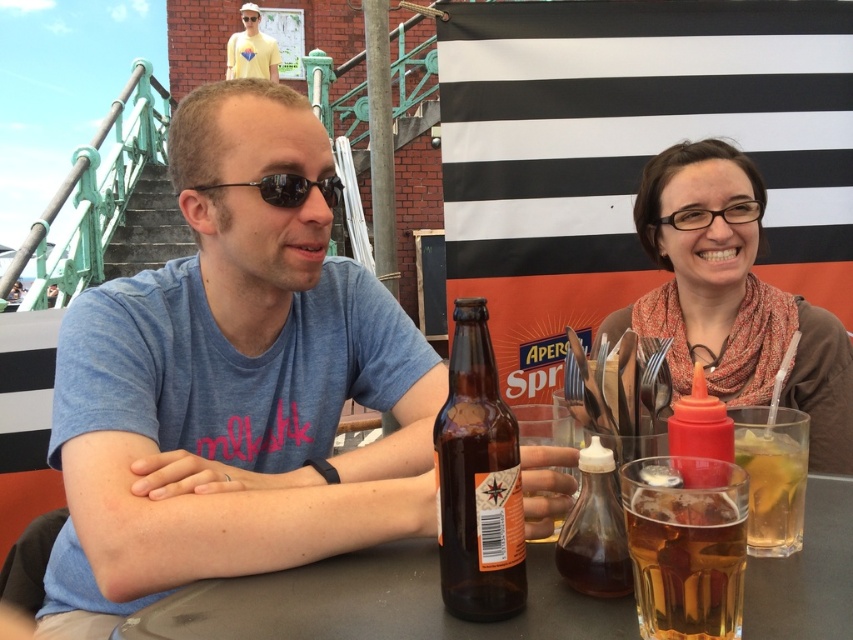
You are a photographer trying to capture the scene from the left side of the table. Which object, the translucent glass bottle at center or the sunglasses at center, would appear closer to the edge of the table in your photo?

The sunglasses at center would appear closer to the edge of the table in the photo because the translucent glass bottle at center is positioned to the right of the sunglasses at center, meaning the sunglasses are nearer to the left edge from the photographer perspective.

Where is the smooth gray table at center located in the image?

The smooth gray table at center is located at point 0.944 on the x axis and 0.438 on the y axis.

Consider the image. You are a server at the outdoor dining area. You need to place a new menu on the table without blocking the brown glass bottle at center. Considering the height of the smooth gray table at center and the bottle, where should you place the menu?

The smooth gray table at center has a lesser height compared to brown glass bottle at center, so placing the menu to the side of the bottle on the table would ensure it doesn not block the bottle while utilizing the available space.